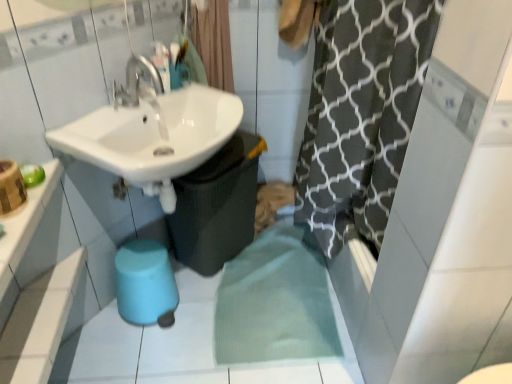
Question: Does point (140, 284) appear closer or farther from the camera than point (211, 36)?

Choices:
 (A) closer
 (B) farther

Answer: (A)

Question: Is blue rubber bidet at lower center wider or thinner than black textured shower curtain at upper center?

Choices:
 (A) wide
 (B) thin

Answer: (A)

Question: Based on their relative distances, which object is farther from the blue rubber bidet at lower center?

Choices:
 (A) black textured shower curtain at upper center
 (B) white glossy counter top at upper left
 (C) white glossy sink at upper left

Answer: (A)

Question: Which is nearer to the blue rubber bidet at lower center?

Choices:
 (A) black textured shower curtain at upper center
 (B) white glossy counter top at upper left
 (C) white glossy sink at upper left

Answer: (C)